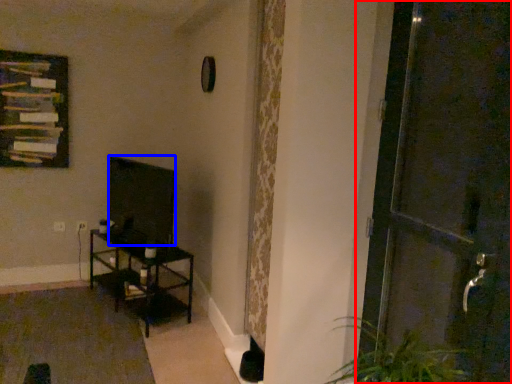
Question: Which object is further to the camera taking this photo, door (highlighted by a red box) or wide (highlighted by a blue box)?

Choices:
 (A) door
 (B) wide

Answer: (B)